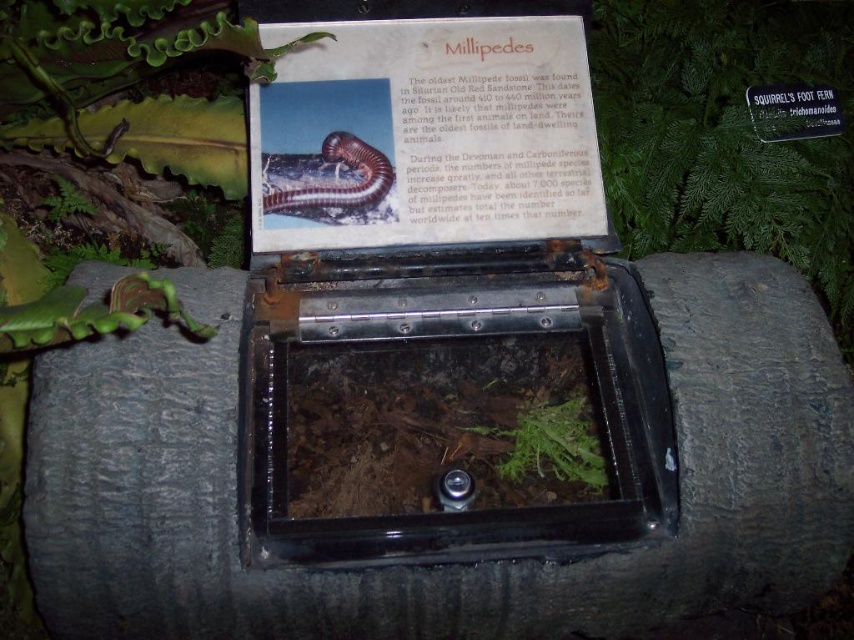
You are a gardener who needs to water both the green leafy plant at center and the green leafy plant at lower left. If your watering can has a maximum reach of 30 inches, can you water both plants without moving the watering can?

The green leafy plant at center is 31.54 inches from the green leafy plant at lower left. Since the watering can has a maximum reach of 30 inches, you cannot water both plants without moving the watering can because the distance between them exceeds the reach.

You are a visitor at the millipede display and want to take a photo that includes both the green leafy fern at upper center and the green leafy plant at lower left. Which direction should you move to ensure both are in frame?

To include both the green leafy fern at upper center and the green leafy plant at lower left in your photo, move to the right side of the display. This way, the green leafy fern at upper center, which is to the right of the green leafy plant at lower left, will be positioned within the frame along with the plant.